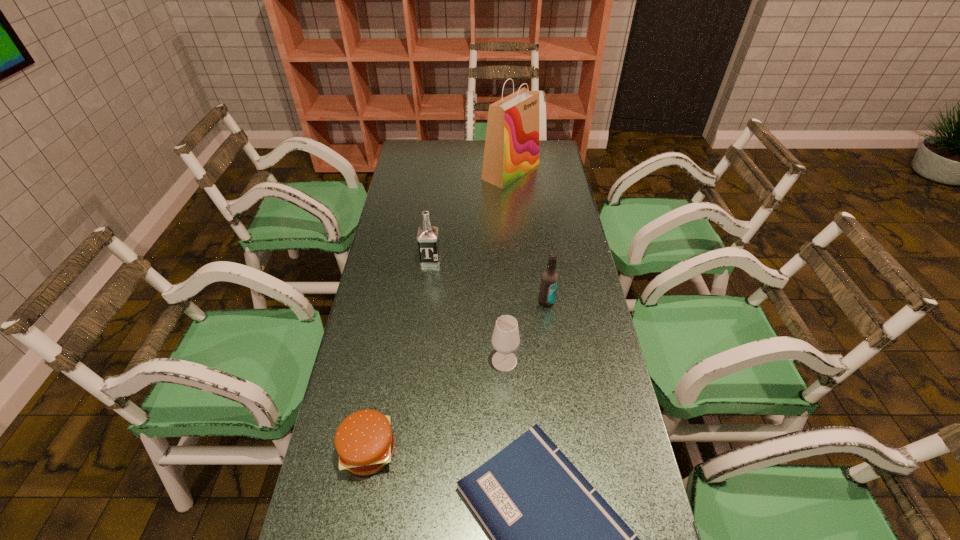
This screenshot has height=540, width=960. What are the coordinates of `vacant area that lies between the hamburger and the fourth farthest object` in the screenshot? It's located at coord(437,406).

Image resolution: width=960 pixels, height=540 pixels. I want to click on free space between the second farthest object and the hamburger, so click(x=399, y=355).

You are a GUI agent. You are given a task and a screenshot of the screen. Output one action in this format:
    pyautogui.click(x=<x>, y=<y>)
    Task: Click on the free area in between the second shortest object and the shopping bag
    This screenshot has width=960, height=540.
    Given the screenshot: What is the action you would take?
    pyautogui.click(x=440, y=310)

I want to click on empty space between the beer bottle and the fifth nearest object, so click(x=489, y=281).

The width and height of the screenshot is (960, 540). In order to click on empty location between the glass and the tallest object in this screenshot , I will do `click(508, 266)`.

What are the coordinates of `free spot between the hamburger and the third nearest object` in the screenshot? It's located at (437, 406).

This screenshot has width=960, height=540. In order to click on empty space between the tallest object and the vodka in this screenshot , I will do `click(470, 216)`.

Image resolution: width=960 pixels, height=540 pixels. Identify the location of vacant point located between the glass and the second farthest object. (468, 311).

Locate an element on the screen. Image resolution: width=960 pixels, height=540 pixels. vacant space that is in between the glass and the fifth tallest object is located at coordinates (437, 406).

Locate which object ranks second in proximity to the second farthest object. Please provide its 2D coordinates. Your answer should be formatted as a tuple, i.e. [(x, y)], where the tuple contains the x and y coordinates of a point satisfying the conditions above.

[(505, 339)]